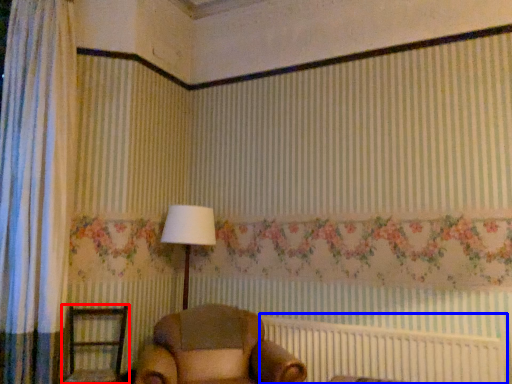
Question: Which object appears farthest to the camera in this image, furniture (highlighted by a red box) or bed frame (highlighted by a blue box)?

Choices:
 (A) furniture
 (B) bed frame

Answer: (A)